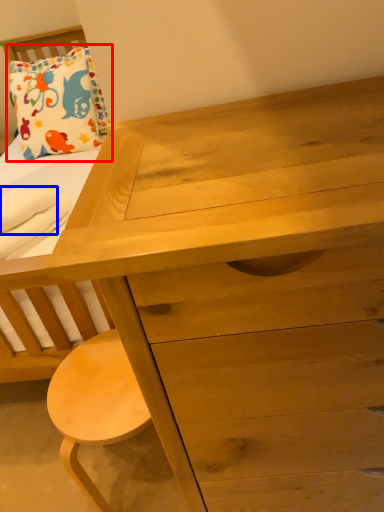
Question: Which point is closer to the camera, pillow (highlighted by a red box) or cloth (highlighted by a blue box)?

Choices:
 (A) pillow
 (B) cloth

Answer: (B)